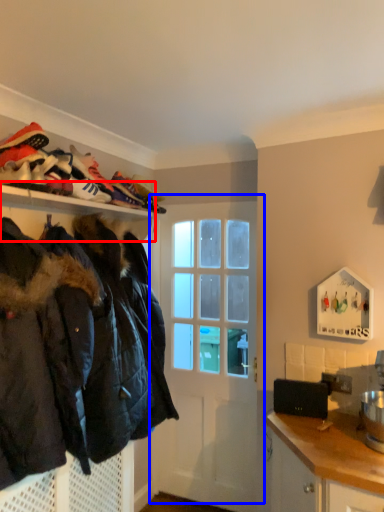
Question: Which point is further to the camera, shelf (highlighted by a red box) or door (highlighted by a blue box)?

Choices:
 (A) shelf
 (B) door

Answer: (B)